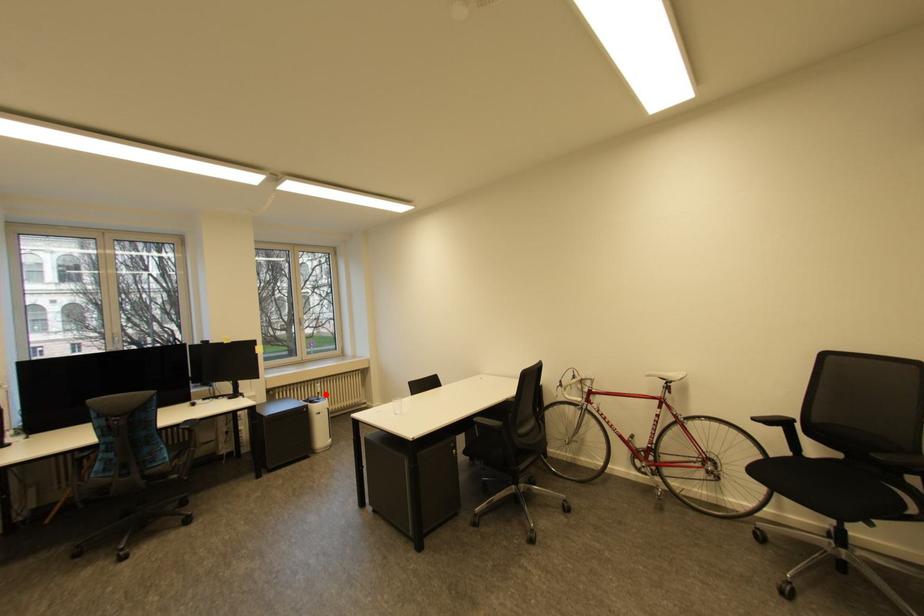
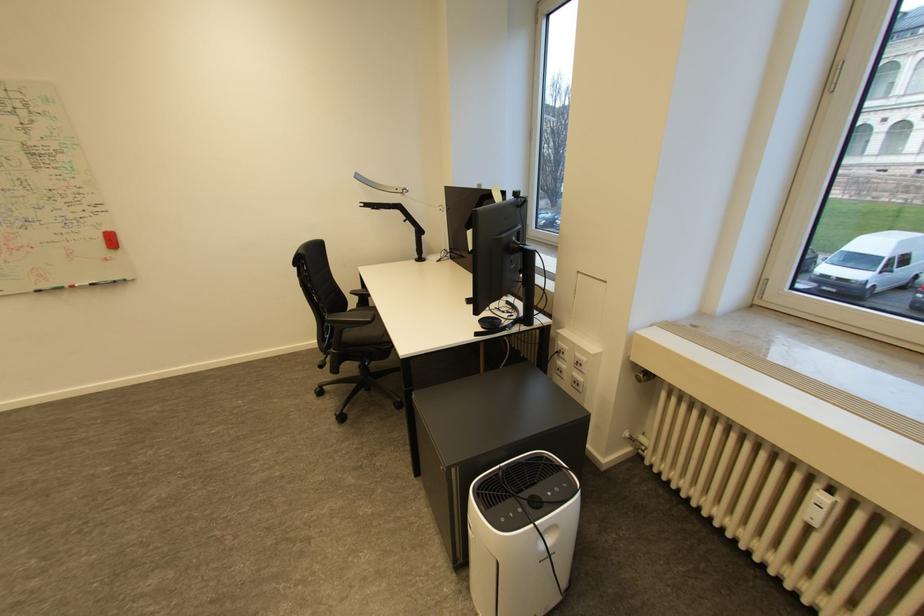
Question: A red point is marked in image1. In image2, is the corresponding 3D point closer to the camera or farther? Reply with the corresponding letter.

Choices:
 (A) The corresponding 3D point is closer.
 (B) The corresponding 3D point is farther.

Answer: (A)